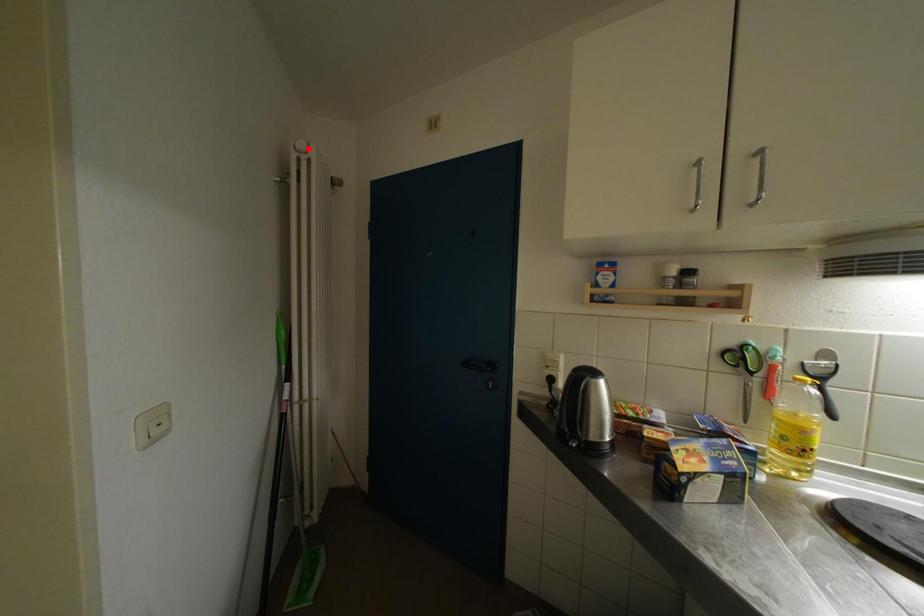
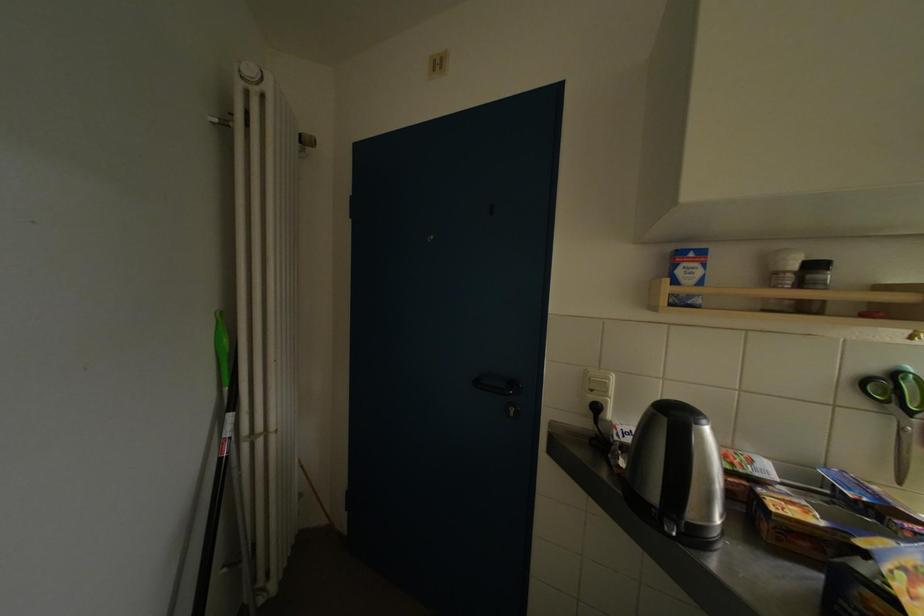
Find the pixel in the second image that matches the highlighted location in the first image.

(256, 75)